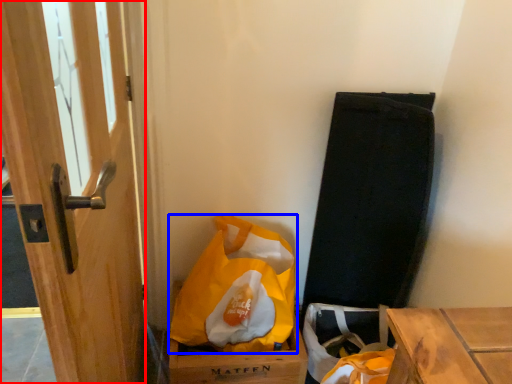
Question: Which object appears farthest to the camera in this image, door (highlighted by a red box) or plastic bag (highlighted by a blue box)?

Choices:
 (A) door
 (B) plastic bag

Answer: (B)